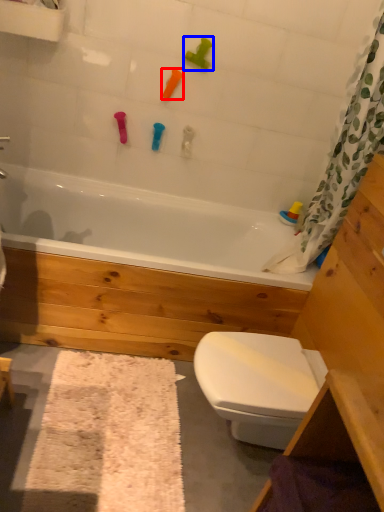
Question: Which object appears farthest to the camera in this image, toy (highlighted by a red box) or toy (highlighted by a blue box)?

Choices:
 (A) toy
 (B) toy

Answer: (A)